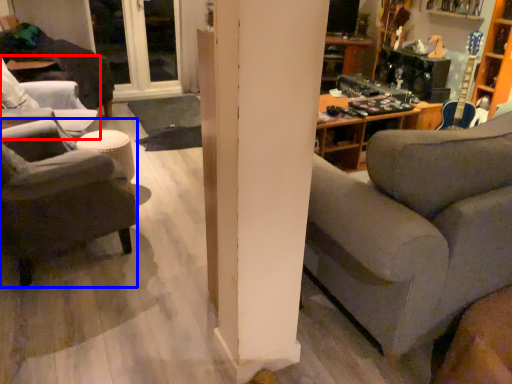
Question: Which object is closer to the camera taking this photo, chair (highlighted by a red box) or chair (highlighted by a blue box)?

Choices:
 (A) chair
 (B) chair

Answer: (B)